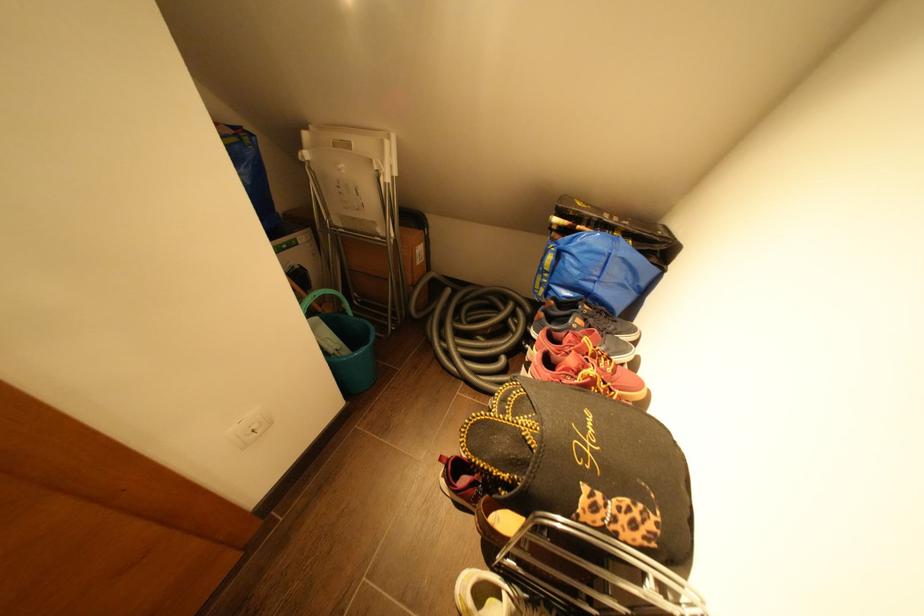
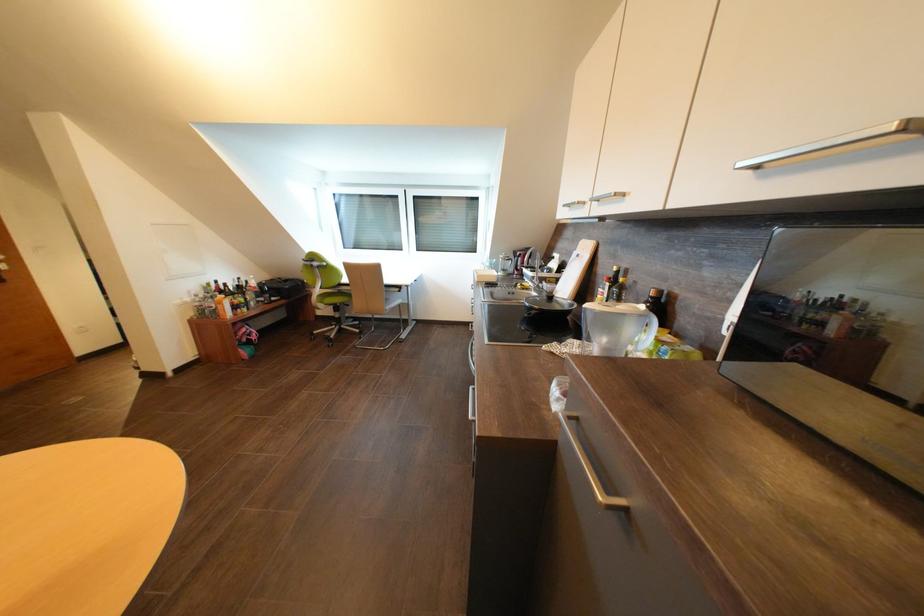
The images are taken continuously from a first-person perspective. In which direction are you moving?

The cameraman moved toward right, backward.